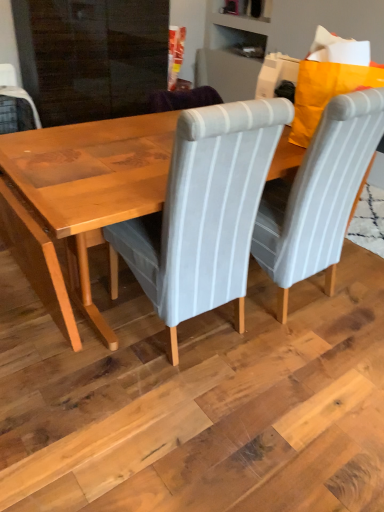
Question: Looking at the image, does wooden table at center seem bigger or smaller compared to light gray fabric chair at center, the 1th chair positioned from the left?

Choices:
 (A) big
 (B) small

Answer: (A)

Question: Would you say wooden table at center is inside or outside light gray fabric chair at center, the 2th chair from the right?

Choices:
 (A) inside
 (B) outside

Answer: (B)

Question: Estimate the real-world distances between objects in this image. Which object is farther from the gray striped fabric chair at center, the 1th chair in the right-to-left sequence?

Choices:
 (A) light gray fabric chair at center, the 1th chair positioned from the left
 (B) wooden table at center

Answer: (B)

Question: Estimate the real-world distances between objects in this image. Which object is farther from the wooden table at center?

Choices:
 (A) gray striped fabric chair at center, the 1th chair in the right-to-left sequence
 (B) light gray fabric chair at center, the 1th chair positioned from the left

Answer: (A)